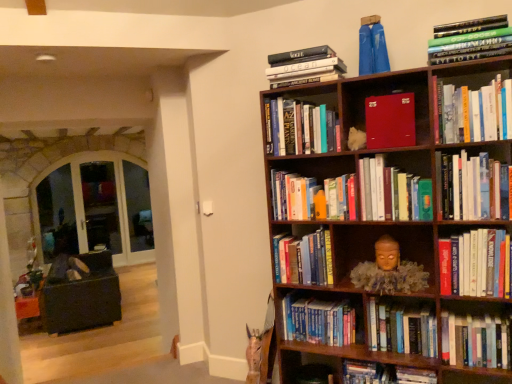
Find the location of `vacant space situated above hardcover book at lower right, which is counted as the first book, starting from the bottom (from a real-world perspective)`. vacant space situated above hardcover book at lower right, which is counted as the first book, starting from the bottom (from a real-world perspective) is located at coordinates (386, 352).